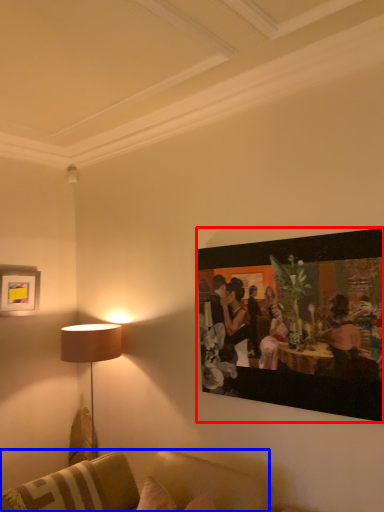
Question: Which object appears closest to the camera in this image, picture frame (highlighted by a red box) or studio couch (highlighted by a blue box)?

Choices:
 (A) picture frame
 (B) studio couch

Answer: (B)